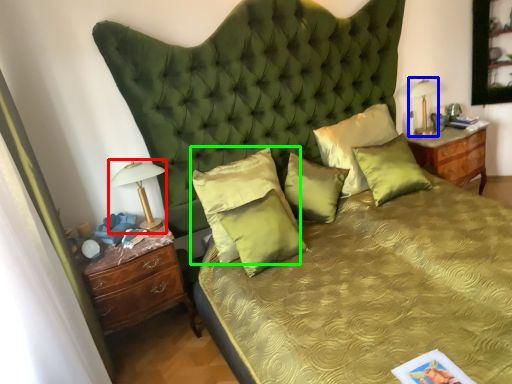
Question: Considering the real-world distances, which object is closest to bedside lamp (highlighted by a red box)? bedside lamp (highlighted by a blue box) or pillow (highlighted by a green box).

Choices:
 (A) bedside lamp
 (B) pillow

Answer: (B)